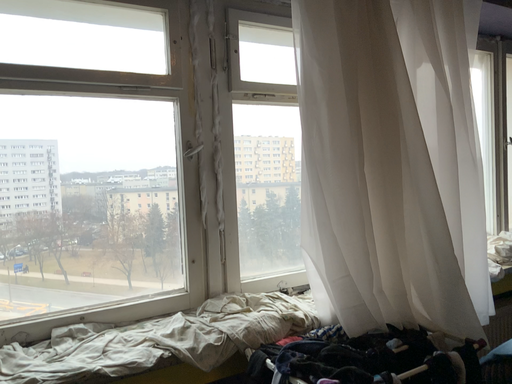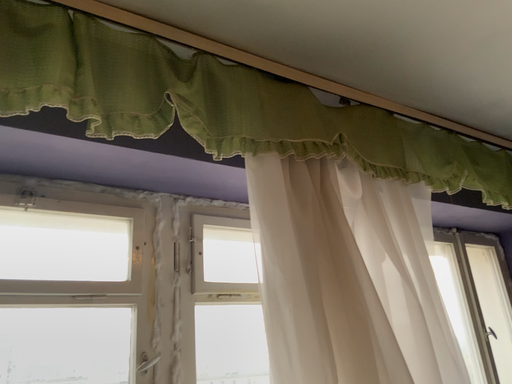
Question: Which way did the camera rotate in the video?

Choices:
 (A) rotated upward
 (B) rotated downward

Answer: (A)